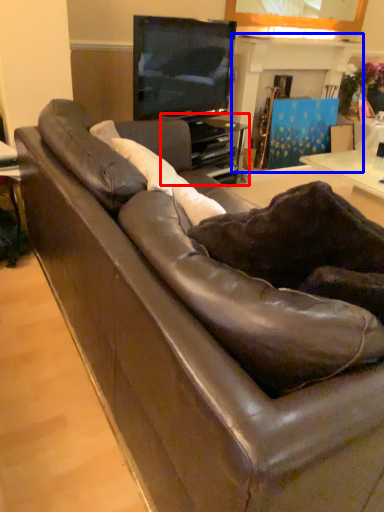
Question: Which object is further to the camera taking this photo, entertainment center (highlighted by a red box) or fireplace (highlighted by a blue box)?

Choices:
 (A) entertainment center
 (B) fireplace

Answer: (B)